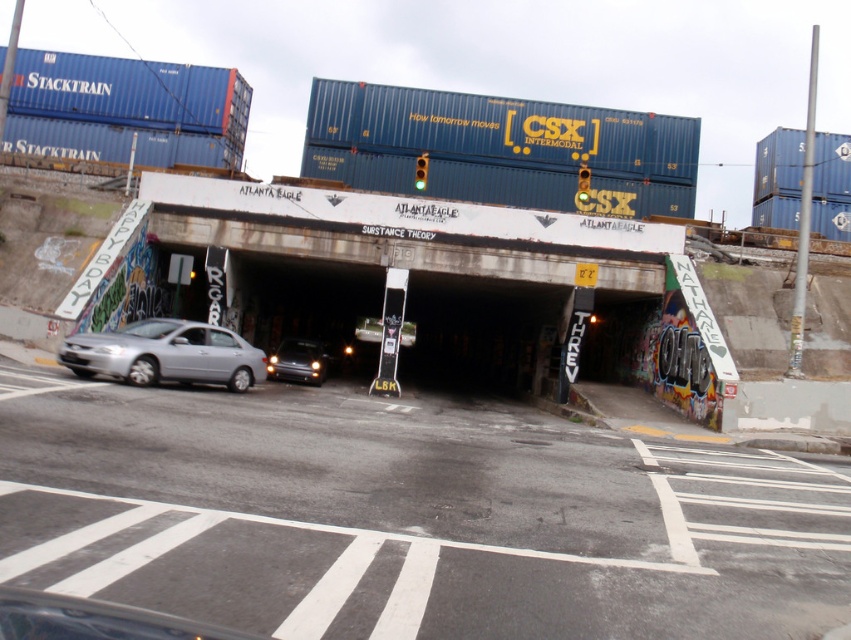
Can you confirm if blue matte container at upper left is positioned below blue matte shipping container at upper right?

No.

In the scene shown: Between blue matte container at upper left and blue matte shipping container at upper right, which one appears on the right side from the viewer's perspective?

blue matte shipping container at upper right

Where is `blue matte container at upper left`? This screenshot has width=851, height=640. blue matte container at upper left is located at coordinates (135, 96).

The width and height of the screenshot is (851, 640). I want to click on blue matte container at upper left, so click(x=135, y=96).

Which of these two, blue matte shipping container at upper center or shiny silver sedan at lower left, stands taller?

blue matte shipping container at upper center is taller.

The width and height of the screenshot is (851, 640). What do you see at coordinates (500, 148) in the screenshot? I see `blue matte shipping container at upper center` at bounding box center [500, 148].

The image size is (851, 640). In order to click on blue matte shipping container at upper center in this screenshot , I will do `click(500, 148)`.

How distant is blue matte shipping container at upper center from blue matte container at upper left?

The distance of blue matte shipping container at upper center from blue matte container at upper left is 36.93 feet.

Does point (517, 188) lie in front of point (84, 156)?

Yes, point (517, 188) is closer to viewer.

Image resolution: width=851 pixels, height=640 pixels. Find the location of `blue matte shipping container at upper center`. blue matte shipping container at upper center is located at coordinates (500, 148).